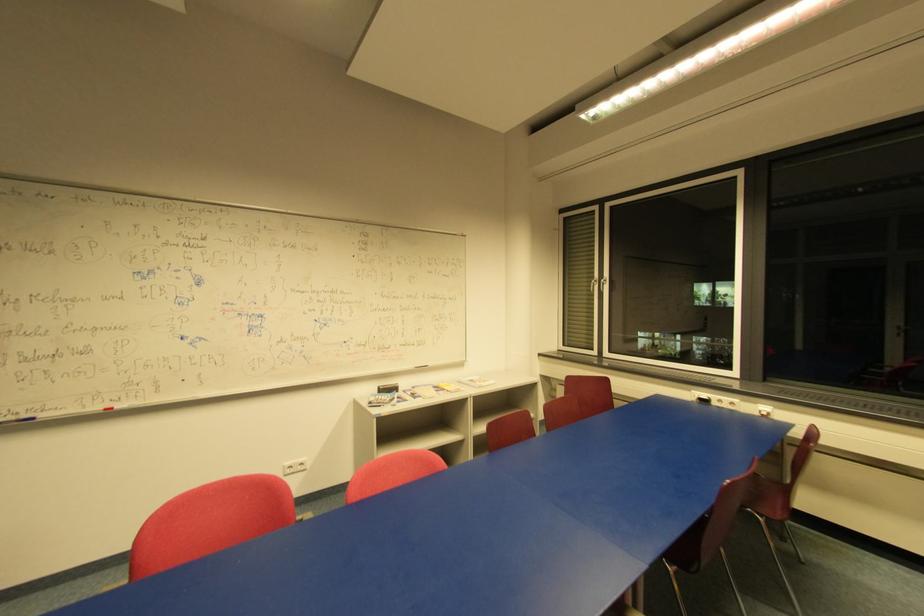
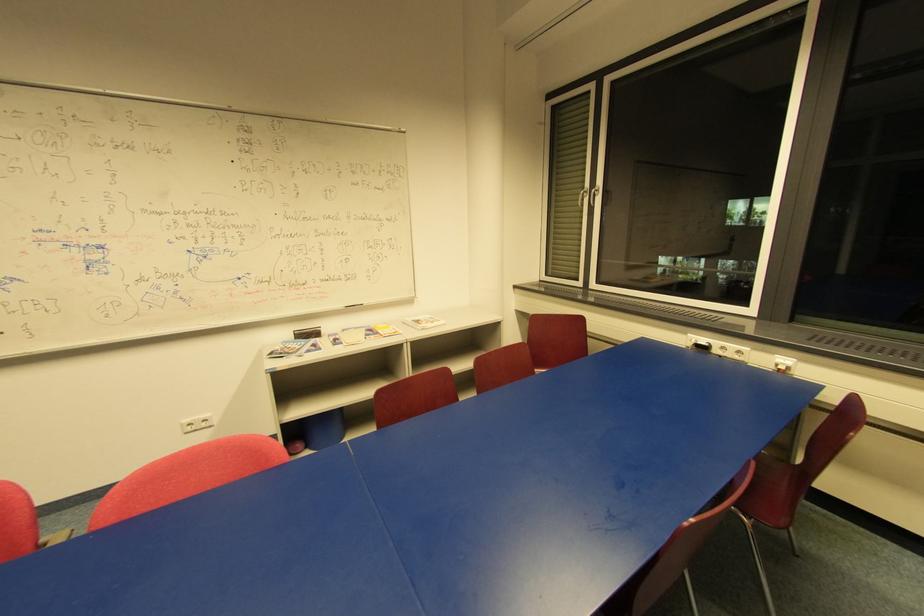
In the second image, find the point that corresponds to the point at 398,387 in the first image.

(319, 331)